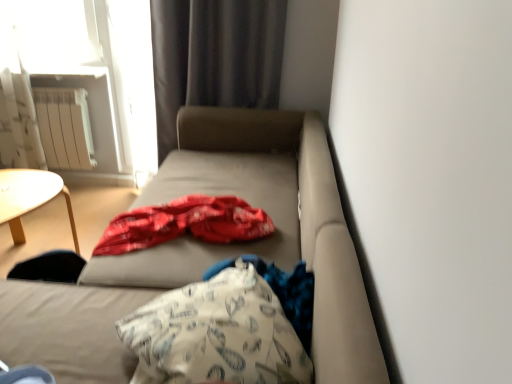
Question: In terms of width, does white printed fabric at center look wider or thinner when compared to white metallic radiator at upper left?

Choices:
 (A) wide
 (B) thin

Answer: (A)

Question: From the image's perspective, is white printed fabric at center positioned above or below white metallic radiator at upper left?

Choices:
 (A) above
 (B) below

Answer: (B)

Question: Estimate the real-world distances between objects in this image. Which object is closer to the matte beige studio couch at center?

Choices:
 (A) white metallic radiator at upper left
 (B) white printed fabric at center
 (C) white fabric throw pillow at center
 (D) dark gray fabric curtain at upper center

Answer: (C)

Question: Which object is positioned farthest from the white printed fabric at center?

Choices:
 (A) white metallic radiator at upper left
 (B) white fabric throw pillow at center
 (C) dark gray fabric curtain at upper center
 (D) matte beige studio couch at center

Answer: (A)